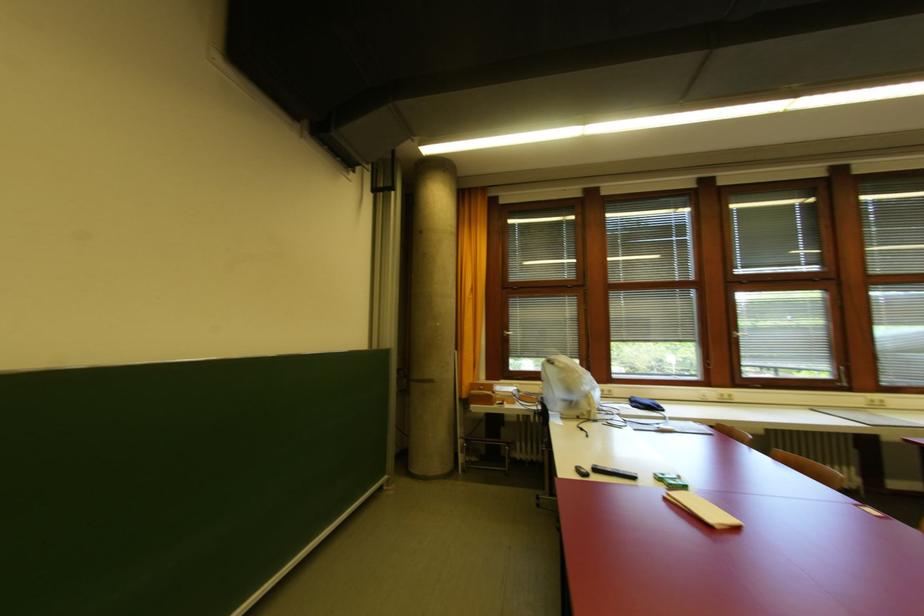
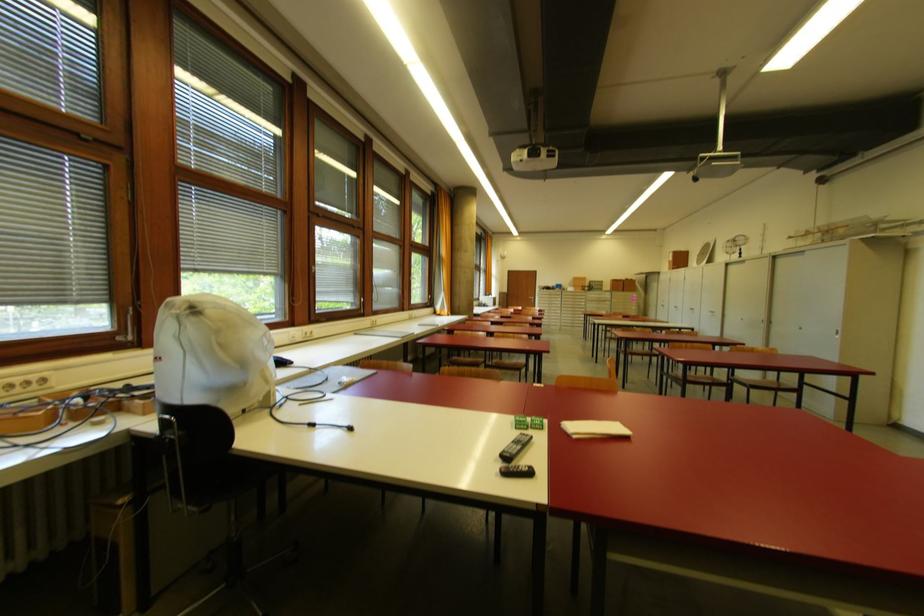
Find the pixel in the second image that matches the point at 839,374 in the first image.

(360, 305)